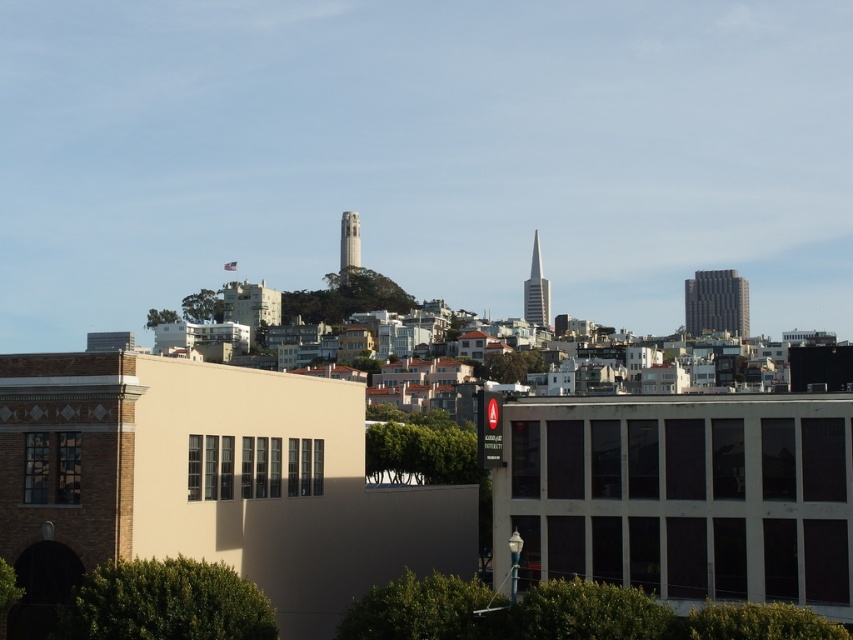
Is dark gray textured building at right behind smooth concrete tower at center?

Yes.

Identify the location of dark gray textured building at right. (717, 301).

Can you confirm if dark gray textured building at right is positioned to the right of shiny glass skyscraper at center?

Indeed, dark gray textured building at right is positioned on the right side of shiny glass skyscraper at center.

Is point (712, 298) behind point (535, 240)?

Yes, point (712, 298) is behind point (535, 240).

You are a GUI agent. You are given a task and a screenshot of the screen. Output one action in this format:
    pyautogui.click(x=<x>, y=<y>)
    Task: Click on the dark gray textured building at right
    The height and width of the screenshot is (640, 853).
    Given the screenshot: What is the action you would take?
    pyautogui.click(x=717, y=301)

Between point (534, 252) and point (340, 227), which one is positioned in front?

Positioned in front is point (534, 252).

In the scene shown: Is shiny glass skyscraper at center taller than smooth concrete tower at center?

Correct, shiny glass skyscraper at center is much taller as smooth concrete tower at center.

Which is in front, point (538, 276) or point (350, 234)?

Positioned in front is point (350, 234).

The width and height of the screenshot is (853, 640). Identify the location of shiny glass skyscraper at center. (537, 291).